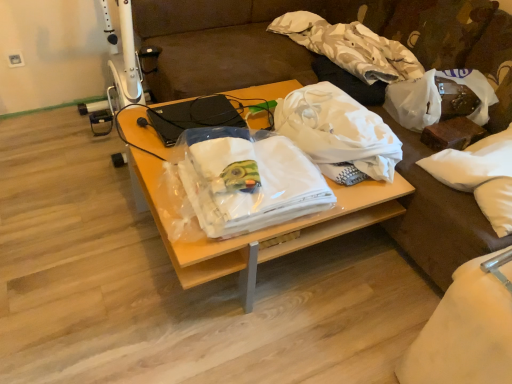
Question: From a real-world perspective, is white cotton cloth at upper center, placed as the 2th cloth when sorted from bottom to top, below white plastic power outlet at upper left?

Choices:
 (A) yes
 (B) no

Answer: (B)

Question: Does white cotton cloth at upper center, placed as the 2th cloth when sorted from bottom to top, turn towards white plastic power outlet at upper left?

Choices:
 (A) yes
 (B) no

Answer: (A)

Question: From the image's perspective, is white cotton cloth at upper center, which appears as the 2th cloth when viewed from the front, under white plastic power outlet at upper left?

Choices:
 (A) no
 (B) yes

Answer: (A)

Question: From a real-world perspective, does white cotton cloth at upper center, positioned as the 1th cloth in back-to-front order, stand above white plastic power outlet at upper left?

Choices:
 (A) no
 (B) yes

Answer: (B)

Question: Considering the relative sizes of white cotton cloth at upper center, which appears as the 2th cloth when viewed from the front, and white plastic power outlet at upper left in the image provided, is white cotton cloth at upper center, which appears as the 2th cloth when viewed from the front, wider than white plastic power outlet at upper left?

Choices:
 (A) no
 (B) yes

Answer: (B)

Question: Is white cotton cloth at upper center, the first cloth from the top, bigger than white plastic power outlet at upper left?

Choices:
 (A) yes
 (B) no

Answer: (A)

Question: From a real-world perspective, does white matte plastic bag at center, which is counted as the first plastic bag, starting from the left, sit lower than white soft pillow at right?

Choices:
 (A) no
 (B) yes

Answer: (A)

Question: Is white matte plastic bag at center, which appears as the 2th plastic bag when viewed from the right, to the left of white soft pillow at right from the viewer's perspective?

Choices:
 (A) no
 (B) yes

Answer: (B)

Question: From the image's perspective, would you say white matte plastic bag at center, which appears as the 2th plastic bag when viewed from the right, is shown under white soft pillow at right?

Choices:
 (A) yes
 (B) no

Answer: (B)

Question: Is white matte plastic bag at center, which is counted as the first plastic bag, starting from the left, not near white soft pillow at right?

Choices:
 (A) no
 (B) yes

Answer: (A)

Question: Is white soft pillow at right at the back of white matte plastic bag at center, which appears as the 2th plastic bag when viewed from the right?

Choices:
 (A) no
 (B) yes

Answer: (A)

Question: Could you tell me if white matte plastic bag at center, which appears as the 2th plastic bag when viewed from the right, is turned towards white soft pillow at right?

Choices:
 (A) no
 (B) yes

Answer: (A)

Question: Is white cotton cloth at upper center, the first cloth from the top, to the right of white matte plastic bag at center, which appears as the 2th plastic bag when viewed from the right, from the viewer's perspective?

Choices:
 (A) no
 (B) yes

Answer: (B)